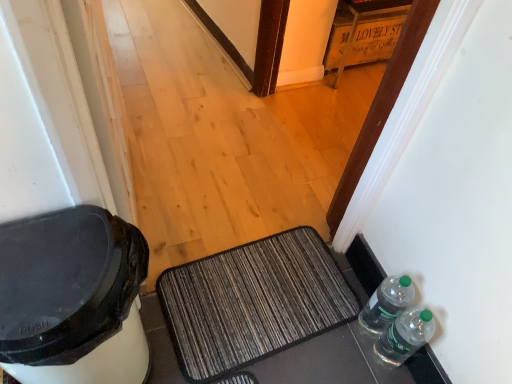
Question: From a real-world perspective, is clear plastic bottles at lower right, which appears as the 2th bottle when viewed from the front, above or below clear plastic bottles at lower right, which is the first bottle in front-to-back order?

Choices:
 (A) below
 (B) above

Answer: (A)

Question: From the image's perspective, relative to clear plastic bottles at lower right, the second bottle viewed from the back, is clear plastic bottles at lower right, which appears as the 2th bottle when viewed from the front, above or below?

Choices:
 (A) above
 (B) below

Answer: (A)

Question: Which is farther from the wooden crate at upper center?

Choices:
 (A) textured gray doormat at center
 (B) clear plastic bottles at lower right, which ranks as the first bottle in back-to-front order
 (C) clear plastic bottles at lower right, which is the first bottle in front-to-back order

Answer: (C)

Question: Which object is positioned closest to the textured gray doormat at center?

Choices:
 (A) clear plastic bottles at lower right, which ranks as the first bottle in back-to-front order
 (B) clear plastic bottles at lower right, the second bottle viewed from the back
 (C) wooden crate at upper center

Answer: (A)